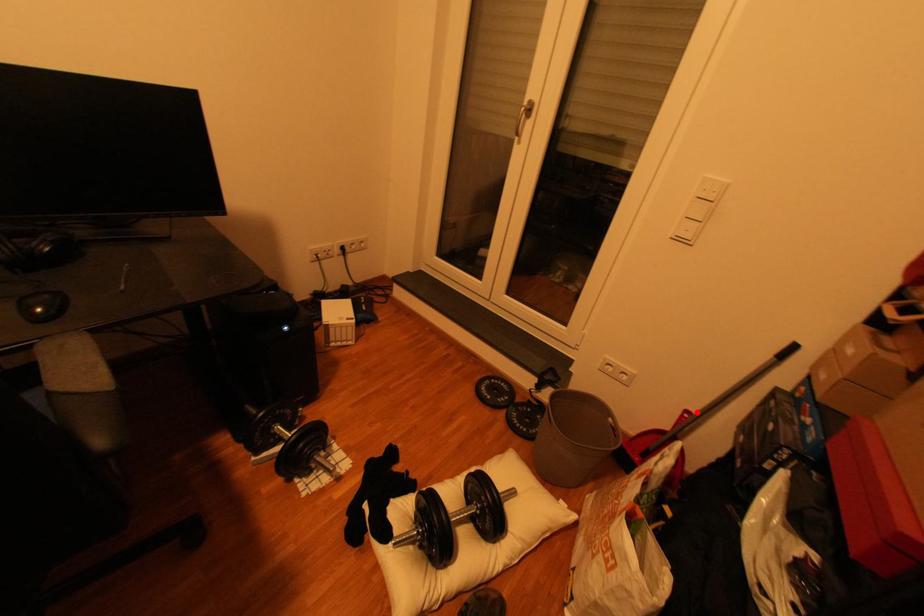
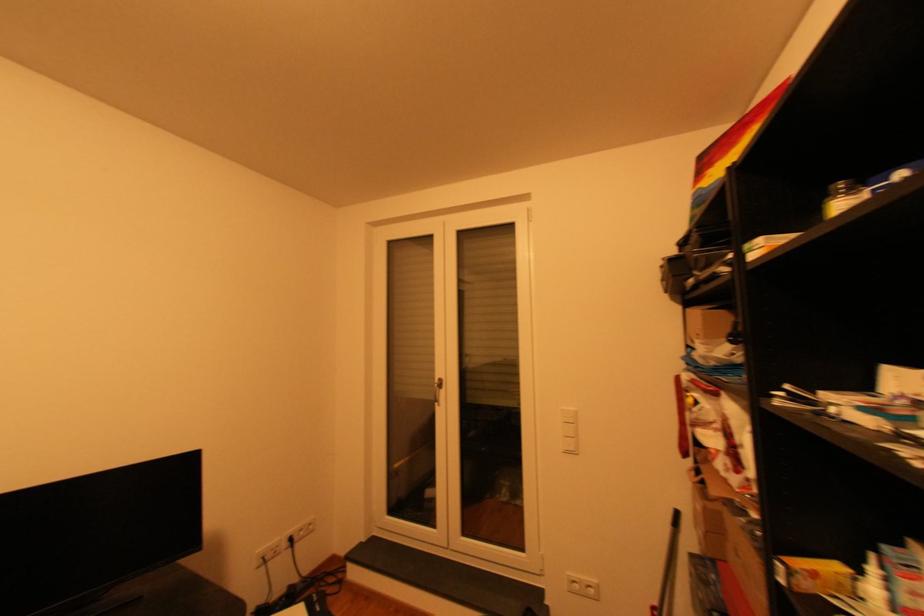
Locate, in the second image, the point that corresponds to the highlighted location in the first image.

(662, 608)